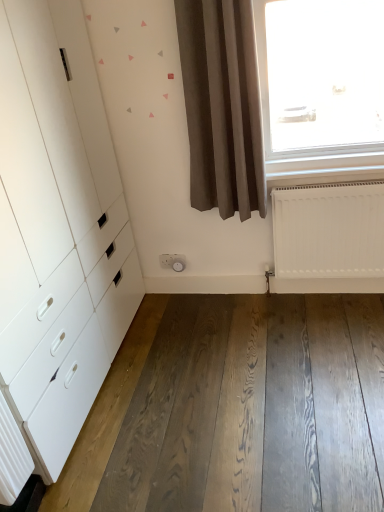
Question: Is white matte radiator at lower right at the right side of white plastic socket at center?

Choices:
 (A) yes
 (B) no

Answer: (A)

Question: From a real-world perspective, is white matte radiator at lower right on white plastic socket at center?

Choices:
 (A) no
 (B) yes

Answer: (B)

Question: From a real-world perspective, is white matte radiator at lower right located beneath white plastic socket at center?

Choices:
 (A) yes
 (B) no

Answer: (B)

Question: Considering the relative positions of white matte radiator at lower right and white plastic socket at center in the image provided, is white matte radiator at lower right to the left of white plastic socket at center from the viewer's perspective?

Choices:
 (A) yes
 (B) no

Answer: (B)

Question: Does white matte radiator at lower right have a lesser height compared to white plastic socket at center?

Choices:
 (A) no
 (B) yes

Answer: (A)

Question: From the image's perspective, is white matte radiator at lower right on top of white plastic socket at center?

Choices:
 (A) yes
 (B) no

Answer: (A)

Question: Is brown matte curtain at center next to white matte radiator at lower right and touching it?

Choices:
 (A) no
 (B) yes

Answer: (A)

Question: From a real-world perspective, is brown matte curtain at center positioned over white matte radiator at lower right based on gravity?

Choices:
 (A) no
 (B) yes

Answer: (B)

Question: Are brown matte curtain at center and white matte radiator at lower right far apart?

Choices:
 (A) yes
 (B) no

Answer: (B)

Question: From a real-world perspective, is brown matte curtain at center below white matte radiator at lower right?

Choices:
 (A) no
 (B) yes

Answer: (A)

Question: Is brown matte curtain at center positioned with its back to white matte radiator at lower right?

Choices:
 (A) no
 (B) yes

Answer: (A)

Question: Is brown matte curtain at center to the right of white matte radiator at lower right from the viewer's perspective?

Choices:
 (A) yes
 (B) no

Answer: (B)

Question: Does white matte radiator at lower right have a smaller size compared to brown matte curtain at center?

Choices:
 (A) yes
 (B) no

Answer: (A)